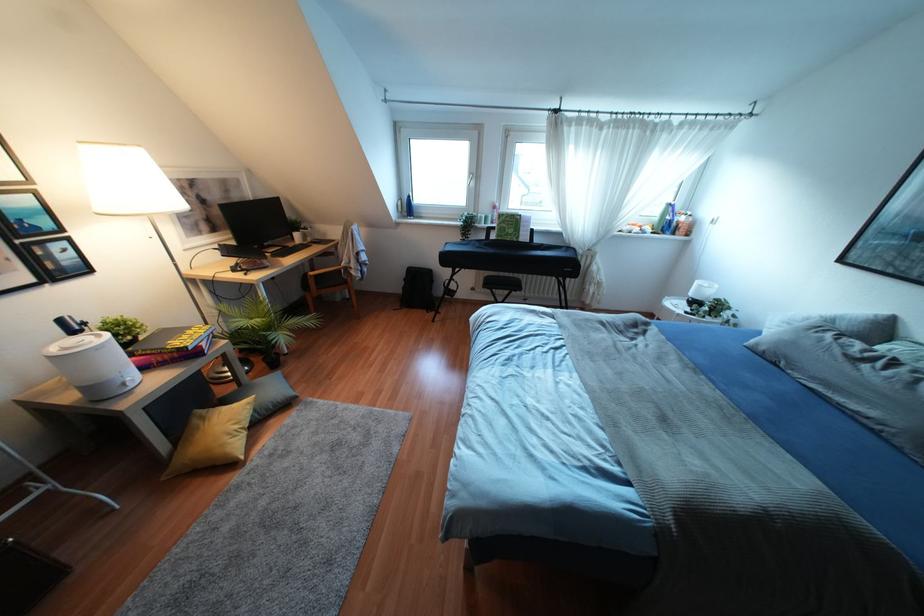
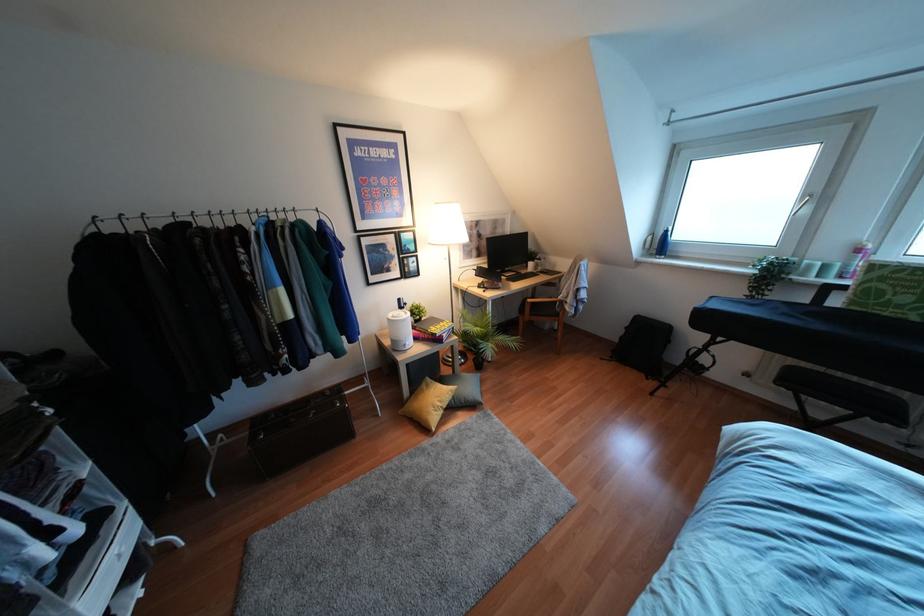
Locate, in the second image, the point that corresponds to the point at 236,426 in the first image.

(439, 403)